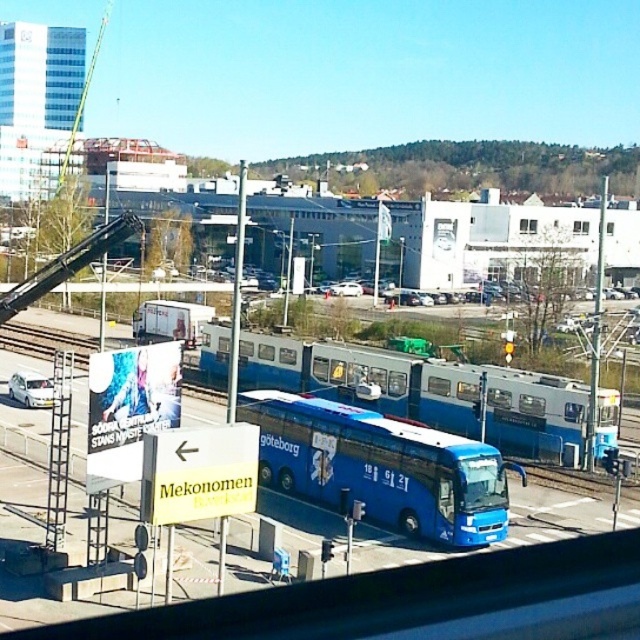
Is blue matte bus at center positioned before blue metallic bus at center?

Yes.

Does point (320, 435) come behind point (552, 406)?

No.

Locate an element on the screen. The height and width of the screenshot is (640, 640). blue matte bus at center is located at coordinates (380, 467).

Find the location of a particular element. blue matte bus at center is located at coordinates (380, 467).